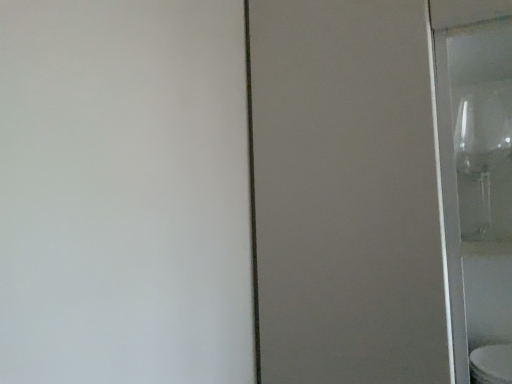
You are a GUI agent. You are given a task and a screenshot of the screen. Output one action in this format:
    pyautogui.click(x=<x>, y=<y>)
    Task: Click on the white matte screen door at right
    The height and width of the screenshot is (384, 512).
    Given the screenshot: What is the action you would take?
    pyautogui.click(x=124, y=193)

This screenshot has height=384, width=512. What do you see at coordinates (124, 193) in the screenshot?
I see `white matte screen door at right` at bounding box center [124, 193].

At what (x,y) coordinates should I click in order to perform the action: click on white matte screen door at right. Please return your answer as a coordinate pair (x, y). The width and height of the screenshot is (512, 384). Looking at the image, I should click on (124, 193).